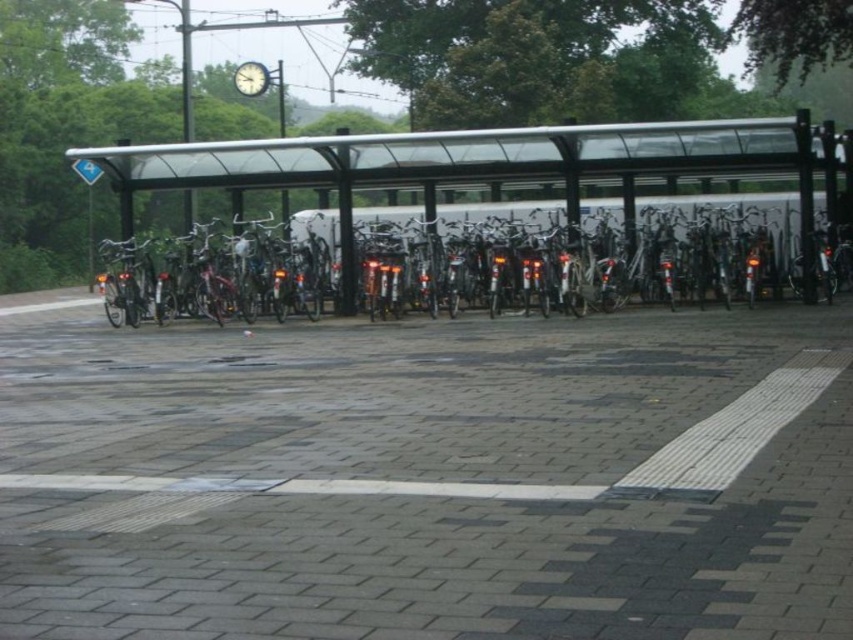
Question: Can you confirm if metallic silver bicycle at center is thinner than metallic clock at upper center?

Choices:
 (A) no
 (B) yes

Answer: (A)

Question: Which object is closer to the camera taking this photo?

Choices:
 (A) metallic clock at upper center
 (B) metallic silver bicycle at center

Answer: (B)

Question: Is metallic silver bicycle at center to the left of metallic clock at upper center from the viewer's perspective?

Choices:
 (A) yes
 (B) no

Answer: (B)

Question: Which of the following is the farthest from the observer?

Choices:
 (A) metallic clock at upper center
 (B) metallic silver bicycle at center

Answer: (A)

Question: Is metallic silver bicycle at center positioned behind metallic clock at upper center?

Choices:
 (A) yes
 (B) no

Answer: (B)